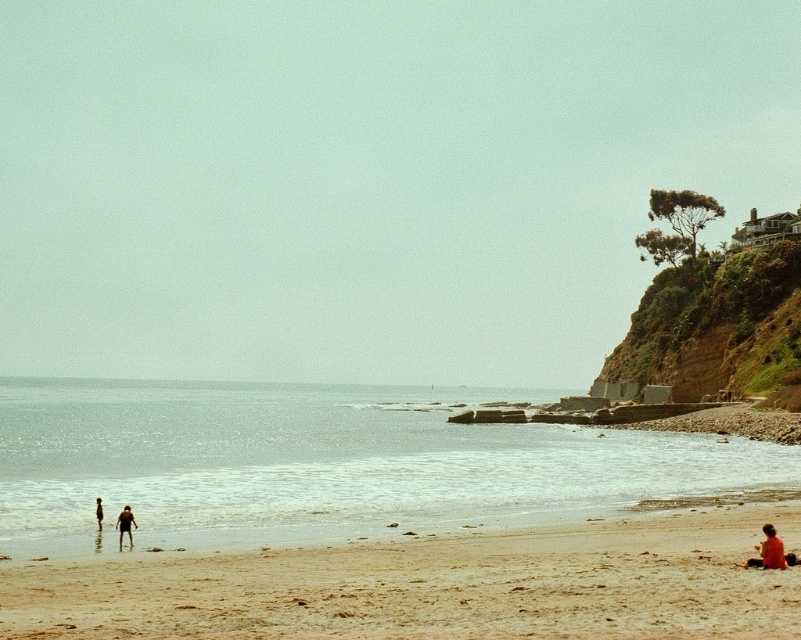
You are a photographer trying to capture the red fabric person at lower right and the beige sandy beach at lower center in the same frame. Based on their positions, which object is located to the left of the other?

The beige sandy beach at lower center is positioned on the left side of red fabric person at lower right.

Looking at this image, you are a photographer planning to take a photo of the beach scene. You want to ensure that the clear blue water at lower center and the red fabric person at lower right are both visible in the frame. Based on their relative heights, which object will appear larger in the photo?

The clear blue water at lower center will appear larger in the photo because it has a greater height compared to the red fabric person at lower right.

You are a photographer planning to capture a sunset shot using the image provided. You want to ensure the green mossy rock at upper right and the matte skin couple at lower left are both in focus. Given that the rock is positioned over the couple, will adjusting the focus on the rock automatically keep the couple in focus?

The green mossy rock at upper right is positioned over the matte skin couple at lower left, so adjusting the focus on the rock may not automatically keep the couple in focus because they are at different depths or planes within the scene.